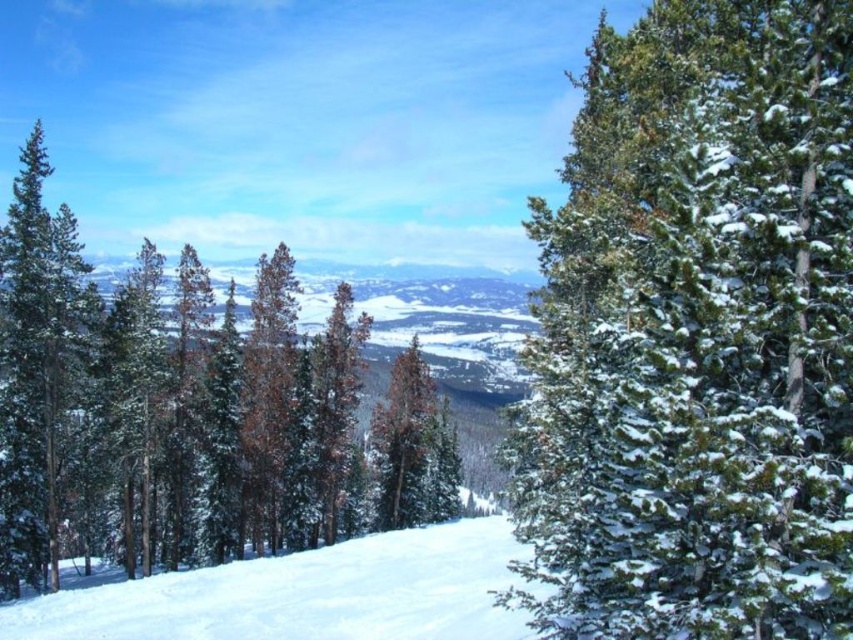
You are an observer standing in the snowy forest. You notice the green textured pine tree at center and the green matte evergreen tree at left. Which tree appears smaller in size?

The green textured pine tree at center has a smaller size compared to the green matte evergreen tree at left, so it appears smaller.

You are standing in the winter forest scene and want to locate the green textured pine tree at center. According to the coordinates given, where would you look in the image?

The green textured pine tree at center is located at the 2D coordinates point (x=695, y=337) in the image.

You are an observer standing in the snowy forest. You notice two trees at the center of your view, the green textured pine tree at center and the green matte evergreen tree at center. Which tree appears closer to you?

The green textured pine tree at center appears closer because it is positioned over the green matte evergreen tree at center, indicating it is in front.